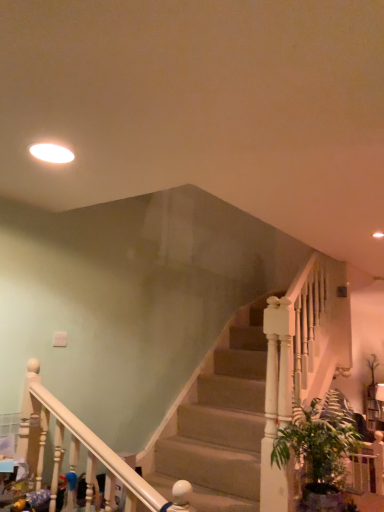
You are a GUI agent. You are given a task and a screenshot of the screen. Output one action in this format:
    pyautogui.click(x=<x>, y=<y>)
    Task: Click on the free space above white glossy light fixture at upper left (from a real-world perspective)
    This screenshot has width=384, height=512.
    Given the screenshot: What is the action you would take?
    pyautogui.click(x=48, y=156)